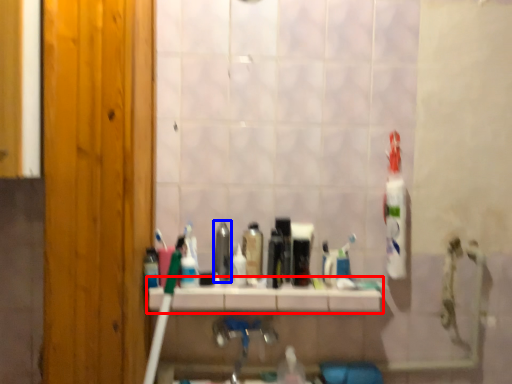
Question: Which object is further to the camera taking this photo, counter top (highlighted by a red box) or mouthwash (highlighted by a blue box)?

Choices:
 (A) counter top
 (B) mouthwash

Answer: (B)